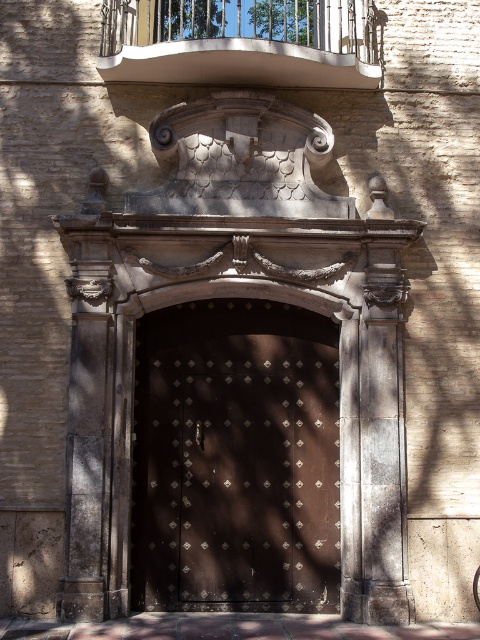
You are a painter hired to paint the dark brown metal door at center and the white metal balcony at upper center. You have a ladder that can reach up to 3 meters. The balcony is 2.5 meters above the ground. Can you safely paint both objects without needing a taller ladder?

The white metal balcony at upper center is 2.5 meters above the ground, which is within the ladder height limit of 3 meters. Since the dark brown metal door at center is smaller than the white metal balcony at upper center, it is likely positioned lower than the balcony. Therefore, the painter can safely paint both objects without needing a taller ladder.

Based on the photo, you are standing in front of the building and want to enter through the dark brown metal door at center. There is a white metal balcony at upper center above the door. Which object is closer to you as you face the building?

The dark brown metal door at center is closer to you than the white metal balcony at upper center because it is positioned further to the viewer.

You are an architect assessing the building facade. The dark brown metal door at center and the white metal balcony at upper center are both key elements. Based on their sizes, which one do you think occupies a larger vertical space on the facade?

The dark brown metal door at center is much taller than the white metal balcony at upper center, so it occupies a larger vertical space on the facade.